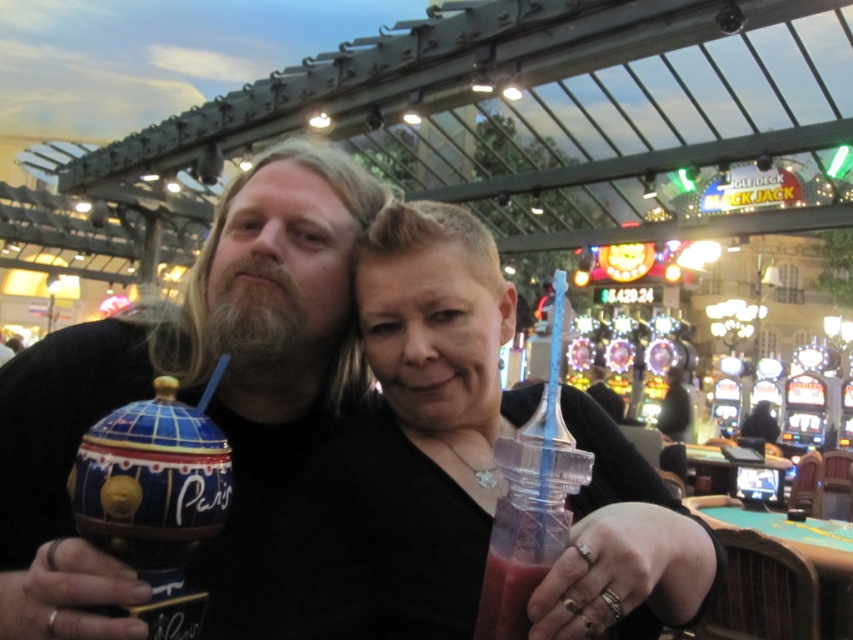
What is the 2D coordinate of the matte ceramic cup at center in the image?

The matte ceramic cup at center is located at the 2D coordinate point of (195, 392).

Based on the photo, what is located at the coordinates point (x=195, y=392) in the image?

The point (x=195, y=392) in the image contains a matte ceramic cup at center.